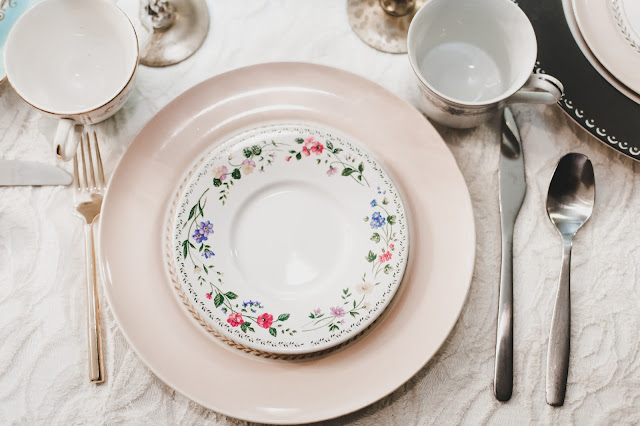
Where is `dinning set`? The height and width of the screenshot is (426, 640). dinning set is located at coordinates (113, 88), (82, 193), (139, 233), (221, 245), (456, 100), (514, 185), (559, 198), (579, 81), (595, 61), (602, 56).